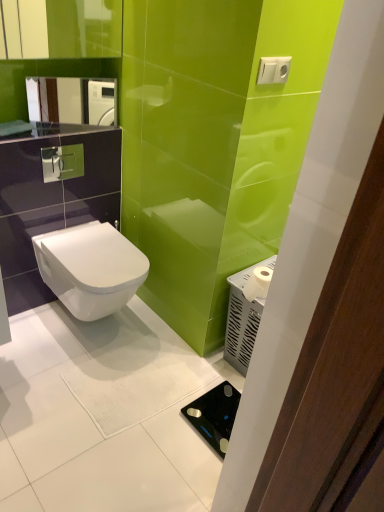
Question: Would you say white glossy toilet at center is outside white matte toilet paper at right?

Choices:
 (A) no
 (B) yes

Answer: (B)

Question: Could white matte toilet paper at right be considered to be inside white glossy toilet at center?

Choices:
 (A) no
 (B) yes

Answer: (A)

Question: Can you confirm if white glossy toilet at center is smaller than white matte toilet paper at right?

Choices:
 (A) yes
 (B) no

Answer: (B)

Question: Can you confirm if white glossy toilet at center is wider than white matte toilet paper at right?

Choices:
 (A) yes
 (B) no

Answer: (A)

Question: Is white glossy toilet at center shorter than white matte toilet paper at right?

Choices:
 (A) yes
 (B) no

Answer: (B)

Question: From the image's perspective, is black glass scale at lower right located above or below white matte toilet paper at right?

Choices:
 (A) above
 (B) below

Answer: (B)

Question: Choose the correct answer: Is black glass scale at lower right inside white matte toilet paper at right or outside it?

Choices:
 (A) outside
 (B) inside

Answer: (A)

Question: Is black glass scale at lower right wider or thinner than white matte toilet paper at right?

Choices:
 (A) thin
 (B) wide

Answer: (B)

Question: Is point (231, 388) positioned closer to the camera than point (266, 281)?

Choices:
 (A) farther
 (B) closer

Answer: (A)

Question: Considering the positions of point [x=97, y=301] and point [x=256, y=270], is point [x=97, y=301] closer or farther from the camera than point [x=256, y=270]?

Choices:
 (A) closer
 (B) farther

Answer: (B)

Question: Looking at their shapes, would you say white glossy toilet at center is wider or thinner than white matte toilet paper at right?

Choices:
 (A) thin
 (B) wide

Answer: (B)

Question: Considering the positions of white glossy toilet at center and white matte toilet paper at right in the image, is white glossy toilet at center taller or shorter than white matte toilet paper at right?

Choices:
 (A) tall
 (B) short

Answer: (A)

Question: From a real-world perspective, is white glossy toilet at center physically located above or below white matte toilet paper at right?

Choices:
 (A) above
 (B) below

Answer: (B)

Question: From their relative heights in the image, would you say white matte toilet paper at right is taller or shorter than white glossy toilet at center?

Choices:
 (A) short
 (B) tall

Answer: (A)

Question: Would you say white matte toilet paper at right is inside or outside white glossy toilet at center?

Choices:
 (A) outside
 (B) inside

Answer: (A)